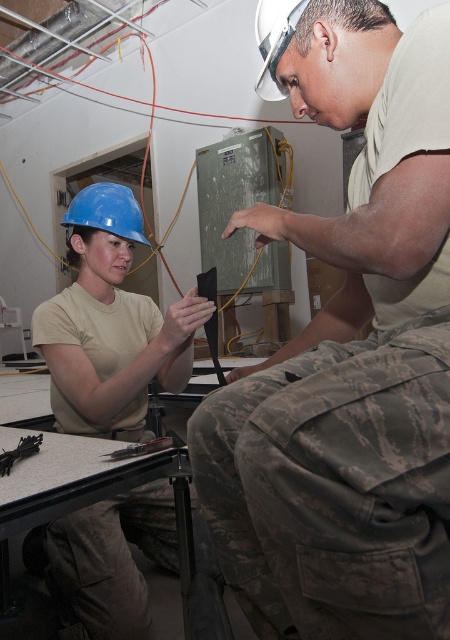
You are a safety inspector in the room. You need to check if the metallic silver screwdriver at center is within reach of the person wearing camouflage fabric pants at lower center. The safety protocol requires that tools must be within 20 inches of the worker to prevent accidents. Is the screwdriver within the required distance?

The distance between the camouflage fabric pants at lower center and the metallic silver screwdriver at center is 21.46 inches. Since this exceeds the 20 inches safety protocol requirement, the screwdriver is not within the required distance.